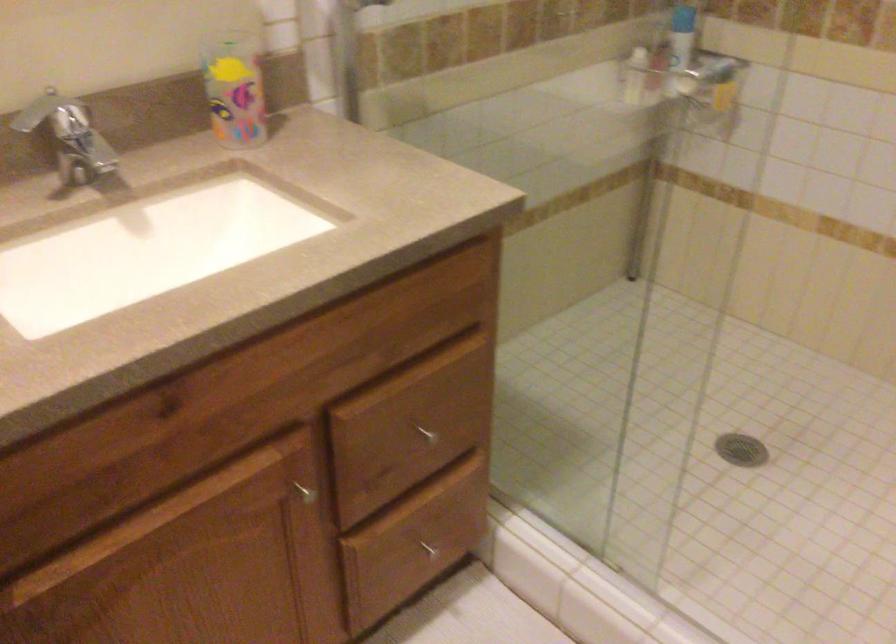
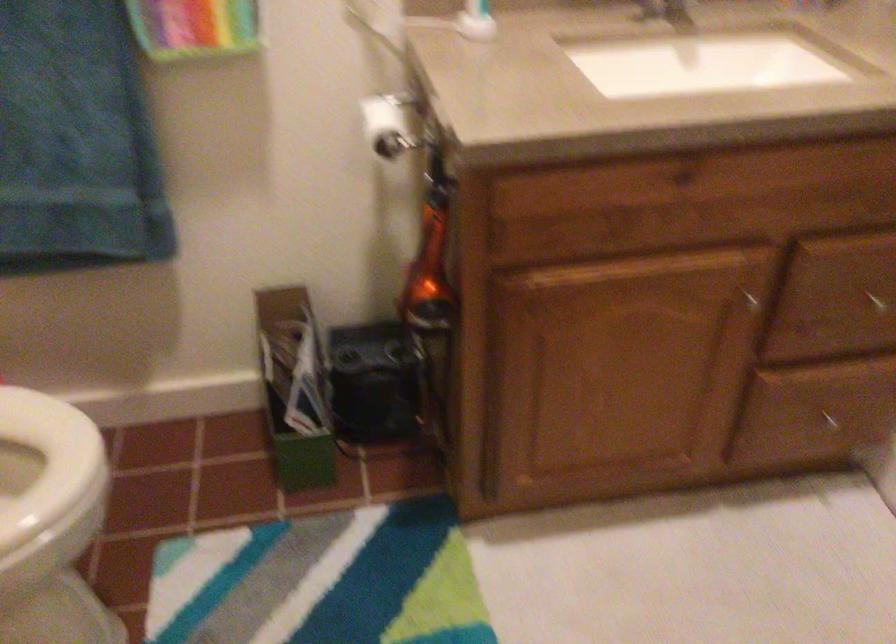
In the second image, find the point that corresponds to (x=431, y=542) in the first image.

(831, 422)